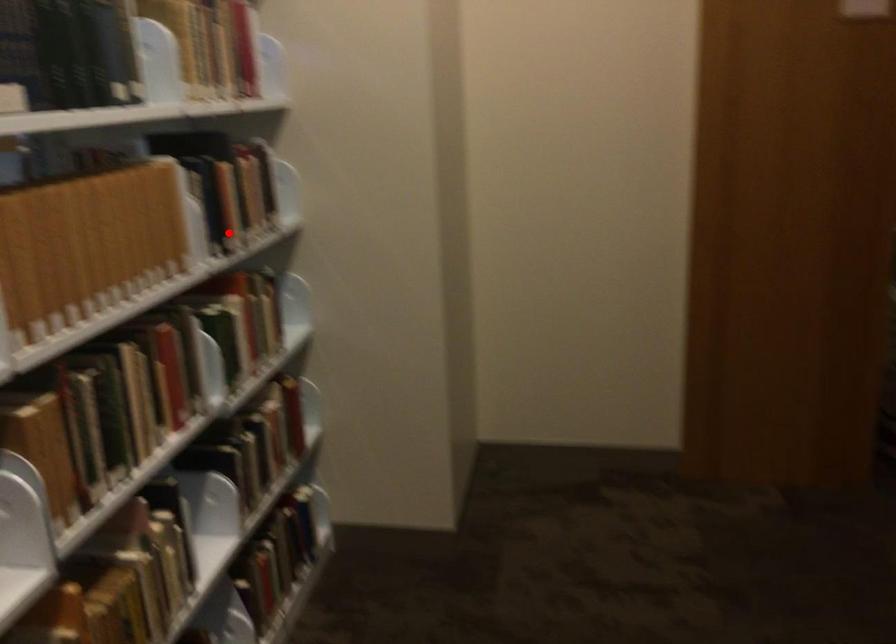
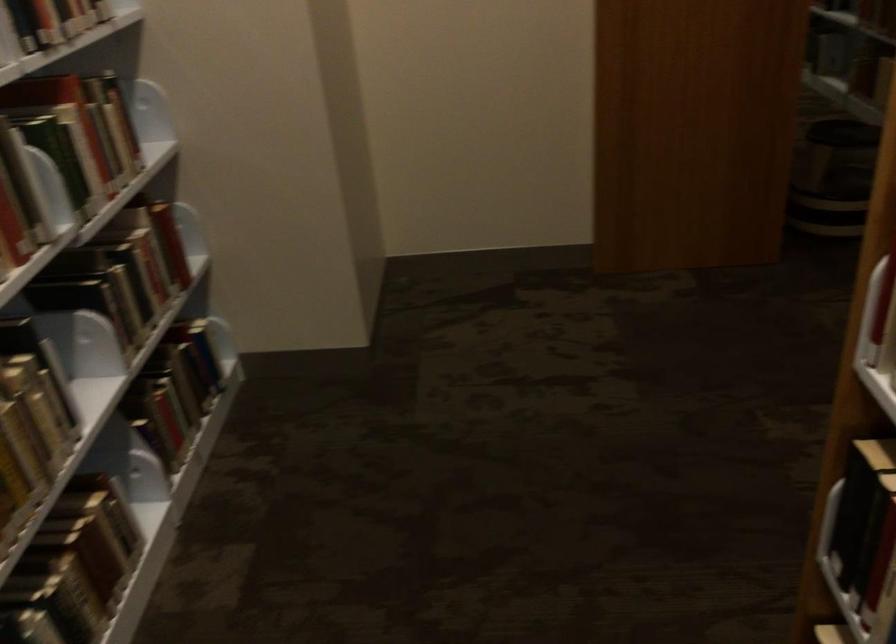
In the second image, find the point that corresponds to the highlighted location in the first image.

(46, 24)